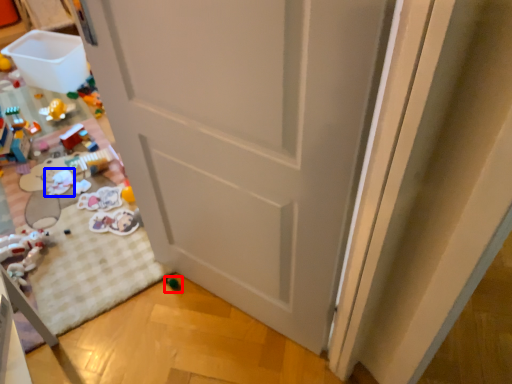
Question: Which object is further to the camera taking this photo, toy (highlighted by a red box) or toy (highlighted by a blue box)?

Choices:
 (A) toy
 (B) toy

Answer: (B)